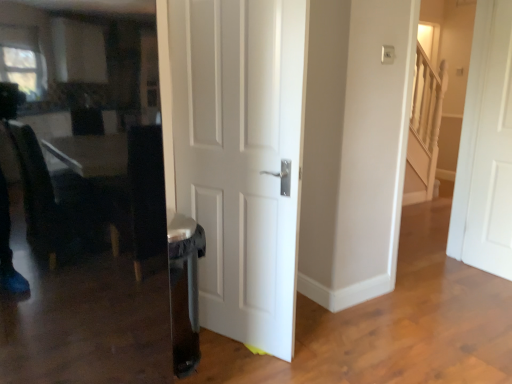
Question: Does white matte door at right, the 2th door in the front-to-back sequence, turn towards white matte door at center, the second door in the right-to-left sequence?

Choices:
 (A) yes
 (B) no

Answer: (A)

Question: From a real-world perspective, does white matte door at right, the 2th door in the front-to-back sequence, sit lower than white matte door at center, the second door in the right-to-left sequence?

Choices:
 (A) yes
 (B) no

Answer: (B)

Question: Does white matte door at right, placed as the first door when sorted from right to left, have a lesser width compared to white matte door at center, which is the second door in back-to-front order?

Choices:
 (A) yes
 (B) no

Answer: (A)

Question: Does white matte door at right, the first door in the back-to-front sequence, touch white matte door at center, which is the second door in back-to-front order?

Choices:
 (A) yes
 (B) no

Answer: (B)

Question: Is white matte door at right, placed as the first door when sorted from right to left, shorter than white matte door at center, positioned as the first door in left-to-right order?

Choices:
 (A) no
 (B) yes

Answer: (A)

Question: Can you confirm if white matte door at right, the first door in the back-to-front sequence, is bigger than white matte door at center, which is the second door in back-to-front order?

Choices:
 (A) no
 (B) yes

Answer: (A)

Question: Is white matte door at center, the second door in the right-to-left sequence, in contact with white matte door at right, the 2th door in the front-to-back sequence?

Choices:
 (A) yes
 (B) no

Answer: (B)

Question: Can you confirm if white matte door at center, positioned as the first door in left-to-right order, is bigger than white matte door at right, which ranks as the second door in left-to-right order?

Choices:
 (A) yes
 (B) no

Answer: (A)

Question: Does white matte door at center, the first door from the front, have a lesser height compared to white matte door at right, the 2th door in the front-to-back sequence?

Choices:
 (A) yes
 (B) no

Answer: (A)

Question: From a real-world perspective, is white matte door at center, the second door in the right-to-left sequence, below white matte door at right, placed as the first door when sorted from right to left?

Choices:
 (A) no
 (B) yes

Answer: (B)

Question: Is white matte door at center, which is the second door in back-to-front order, positioned beyond the bounds of white matte door at right, the first door in the back-to-front sequence?

Choices:
 (A) no
 (B) yes

Answer: (B)

Question: From a real-world perspective, does white matte door at center, the first door from the front, stand above white matte door at right, the first door in the back-to-front sequence?

Choices:
 (A) yes
 (B) no

Answer: (B)

Question: From their relative heights in the image, would you say white matte door at right, placed as the first door when sorted from right to left, is taller or shorter than white matte door at center, the second door in the right-to-left sequence?

Choices:
 (A) short
 (B) tall

Answer: (B)